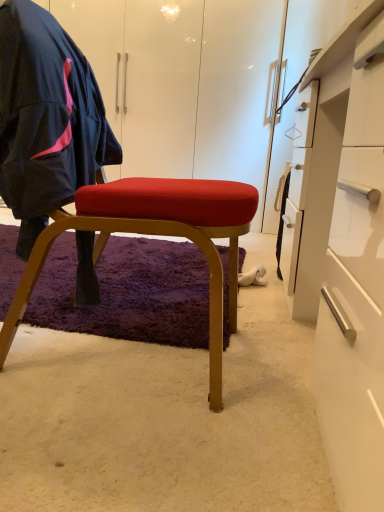
The image size is (384, 512). Find the location of `white glossy desk at center right`. white glossy desk at center right is located at coordinates (343, 250).

Does point (360, 184) come in front of point (31, 4)?

Yes, point (360, 184) is in front of point (31, 4).

In the scene shown: From the image's perspective, is white glossy desk at center right beneath matte black jacket at left?

Yes.

Is white glossy desk at center right not inside matte black jacket at left?

Yes, white glossy desk at center right is not within matte black jacket at left.

Is white glossy desk at center right far from matte black jacket at left?

white glossy desk at center right is actually quite close to matte black jacket at left.

From the image's perspective, is white suede shoe at lower center above matte black jacket at left?

Actually, white suede shoe at lower center appears below matte black jacket at left in the image.

Measure the distance between white suede shoe at lower center and matte black jacket at left.

white suede shoe at lower center is 36.15 inches away from matte black jacket at left.

What's the angular difference between white suede shoe at lower center and matte black jacket at left's facing directions?

The angle between the facing direction of white suede shoe at lower center and the facing direction of matte black jacket at left is 180 degrees.

Can you confirm if white suede shoe at lower center is bigger than matte black jacket at left?

No, white suede shoe at lower center is not bigger than matte black jacket at left.

Based on the photo, from the image's perspective, is matte black jacket at left above white glossy desk at center right?

Yes, from the image's perspective, matte black jacket at left is over white glossy desk at center right.

From a real-world perspective, is matte black jacket at left on top of white glossy desk at center right?

Correct, in the physical world, matte black jacket at left is higher than white glossy desk at center right.

Is matte black jacket at left facing towards white glossy desk at center right?

Yes, matte black jacket at left is aimed at white glossy desk at center right.

Consider the image. Which object is thinner, matte black jacket at left or white glossy desk at center right?

matte black jacket at left is thinner.

Are white glossy desk at center right and matte gold stool at center far apart?

No.

Which is in front, point (333, 193) or point (152, 221)?

The point (152, 221) is closer to the camera.

Considering the relative sizes of white glossy desk at center right and matte gold stool at center in the image provided, is white glossy desk at center right bigger than matte gold stool at center?

Yes, white glossy desk at center right is bigger than matte gold stool at center.

I want to click on desk on the right of matte gold stool at center, so pos(343,250).

Is white suede shoe at lower center not near matte gold stool at center?

white suede shoe at lower center is near matte gold stool at center, not far away.

Between white suede shoe at lower center and matte gold stool at center, which one appears on the right side from the viewer's perspective?

Positioned to the right is white suede shoe at lower center.

Is white suede shoe at lower center in front of or behind matte gold stool at center in the image?

In the image, white suede shoe at lower center appears behind matte gold stool at center.

I want to click on footwear below the matte gold stool at center (from the image's perspective), so click(252, 277).

Is matte gold stool at center at the right side of white glossy desk at center right?

In fact, matte gold stool at center is to the left of white glossy desk at center right.

How much distance is there between matte gold stool at center and white glossy desk at center right?

The distance of matte gold stool at center from white glossy desk at center right is 16.67 inches.

Does matte gold stool at center have a larger size compared to white glossy desk at center right?

Actually, matte gold stool at center might be smaller than white glossy desk at center right.

Is matte gold stool at center facing away from white glossy desk at center right?

No, matte gold stool at center is not facing away from white glossy desk at center right.

Which of these two, matte black jacket at left or matte gold stool at center, stands shorter?

With less height is matte black jacket at left.

From the image's perspective, which one is positioned higher, matte black jacket at left or matte gold stool at center?

matte black jacket at left.

Looking at this image, in terms of size, does matte black jacket at left appear bigger or smaller than matte gold stool at center?

In the image, matte black jacket at left appears to be smaller than matte gold stool at center.

Considering the points (52, 82) and (73, 136), which point is behind, point (52, 82) or point (73, 136)?

The point (73, 136) is farther.

You are a GUI agent. You are given a task and a screenshot of the screen. Output one action in this format:
    pyautogui.click(x=<x>, y=<y>)
    Task: Click on the clothing above the white glossy desk at center right (from a real-world perspective)
    The height and width of the screenshot is (512, 384).
    Given the screenshot: What is the action you would take?
    click(46, 119)

You are a GUI agent. You are given a task and a screenshot of the screen. Output one action in this format:
    pyautogui.click(x=<x>, y=<y>)
    Task: Click on the clothing lying above the white suede shoe at lower center (from the image's perspective)
    
    Given the screenshot: What is the action you would take?
    pyautogui.click(x=46, y=119)

Estimate the real-world distances between objects in this image. Which object is closer to white suede shoe at lower center, matte gold stool at center or matte black jacket at left?

Based on the image, matte gold stool at center appears to be nearer to white suede shoe at lower center.

When comparing their distances from white suede shoe at lower center, does white glossy desk at center right or matte gold stool at center seem closer?

white glossy desk at center right is positioned closer to the anchor white suede shoe at lower center.

From the picture: Based on their spatial positions, is white suede shoe at lower center or matte black jacket at left closer to matte gold stool at center?

The object closer to matte gold stool at center is matte black jacket at left.

Estimate the real-world distances between objects in this image. Which object is further from white glossy desk at center right, matte gold stool at center or matte black jacket at left?

matte black jacket at left.

Estimate the real-world distances between objects in this image. Which object is further from matte gold stool at center, white glossy desk at center right or matte black jacket at left?

Among the two, white glossy desk at center right is located further to matte gold stool at center.

In the scene shown: Which object lies further to the anchor point matte black jacket at left, white suede shoe at lower center or matte gold stool at center?

white suede shoe at lower center lies further to matte black jacket at left than the other object.

From the picture: When comparing their distances from white suede shoe at lower center, does white glossy desk at center right or matte black jacket at left seem closer?

white glossy desk at center right is positioned closer to the anchor white suede shoe at lower center.

From the image, which object appears to be nearer to matte black jacket at left, white glossy desk at center right or white suede shoe at lower center?

white glossy desk at center right lies closer to matte black jacket at left than the other object.

The width and height of the screenshot is (384, 512). In order to click on chair situated between matte black jacket at left and white glossy desk at center right from left to right in this screenshot , I will do click(x=119, y=217).

At what (x,y) coordinates should I click in order to perform the action: click on clothing between matte gold stool at center and white suede shoe at lower center in the front-back direction. Please return your answer as a coordinate pair (x, y). The height and width of the screenshot is (512, 384). Looking at the image, I should click on (46, 119).

At what (x,y) coordinates should I click in order to perform the action: click on clothing positioned between white glossy desk at center right and white suede shoe at lower center from near to far. Please return your answer as a coordinate pair (x, y). Looking at the image, I should click on (46, 119).

The width and height of the screenshot is (384, 512). Identify the location of chair located between white glossy desk at center right and white suede shoe at lower center in the depth direction. (119, 217).